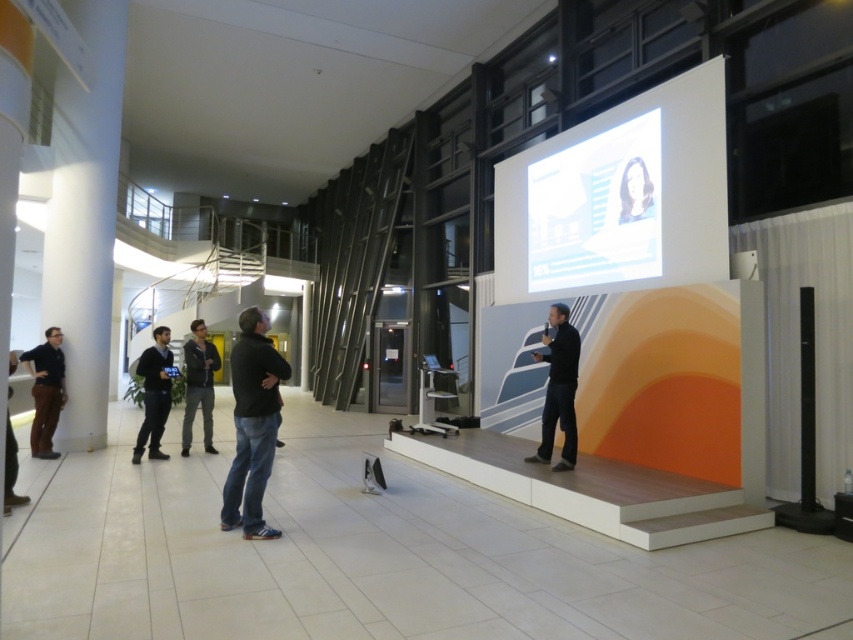
Question: Among these objects, which one is nearest to the camera?

Choices:
 (A) white glossy projection screen at upper center
 (B) matte black shirt at left
 (C) dark gray sweater at lower left
 (D) dark gray sweater at center

Answer: (D)

Question: Does white glossy projection screen at upper center come behind matte black shirt at left?

Choices:
 (A) no
 (B) yes

Answer: (A)

Question: Does matte black shirt at left have a greater width compared to dark gray hoodie at center?

Choices:
 (A) no
 (B) yes

Answer: (A)

Question: Which point is farther to the camera?

Choices:
 (A) (184, 384)
 (B) (567, 378)
 (C) (45, 426)

Answer: (A)

Question: Which of the following is the closest to the observer?

Choices:
 (A) (45, 339)
 (B) (242, 458)
 (C) (553, 326)
 (D) (572, 268)

Answer: (B)

Question: Does matte black shirt at left appear on the right side of dark gray sweater at lower left?

Choices:
 (A) no
 (B) yes

Answer: (A)